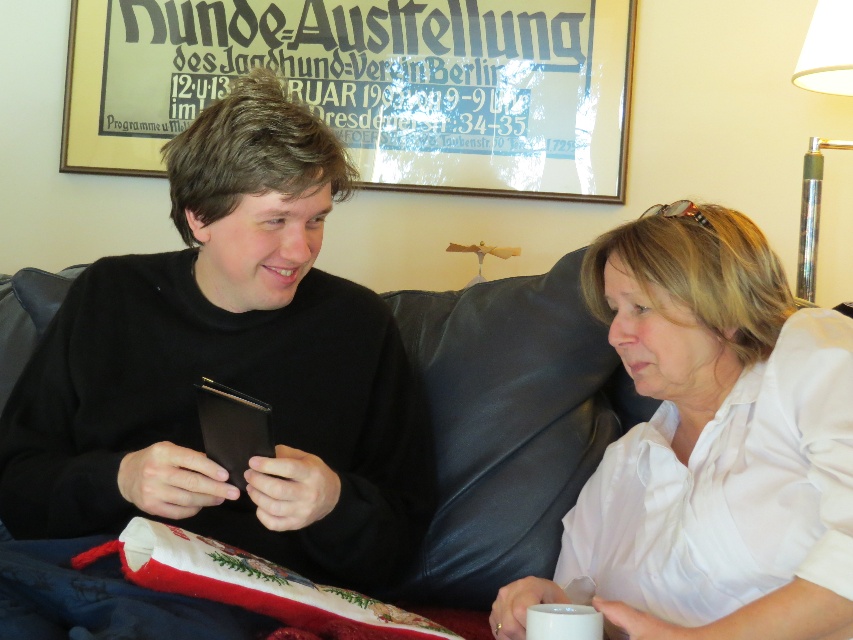
You are a guest at a party and need to retrieve your black matte wallet at left. The host is wearing the white cotton shirt at upper right. Can you reach your wallet without touching the host?

The black matte wallet at left is positioned over the white cotton shirt at upper right, meaning it is placed directly on top of the host wearing the shirt. To retrieve it without touching the host, you would need to carefully slide the wallet off the shirt or ask the host to move it slightly.

Consider the image. You are a photographer who wants to take a picture of the black matte wallet at left and the white cotton shirt at upper right. Do you need to adjust your camera focus to capture both clearly?

The black matte wallet at left is positioned on the left side of white cotton shirt at upper right, so they are in the same plane. Therefore, adjusting the focus should not be necessary as both objects are at a similar distance from the camera.

You are standing in the room and want to place a small decorative item on the floor between the two points labeled point (259, 273) and point (700, 496). According to their positions, which point should you place it closer to so that it is in front of both points?

To place the decorative item in front of both points, it should be placed closer to point (700, 496) since it is in front of point (259, 273).